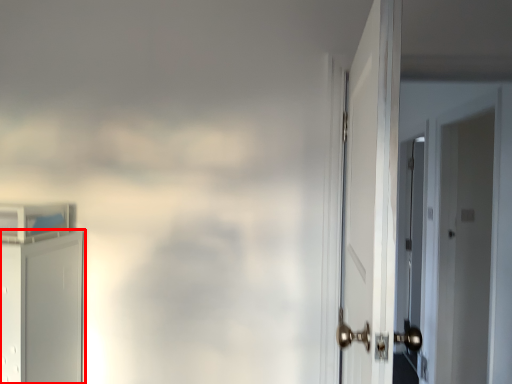
Question: From the image's perspective, what is the correct spatial relationship of door (annotated by the red box) in relation to door?

Choices:
 (A) below
 (B) above

Answer: (A)